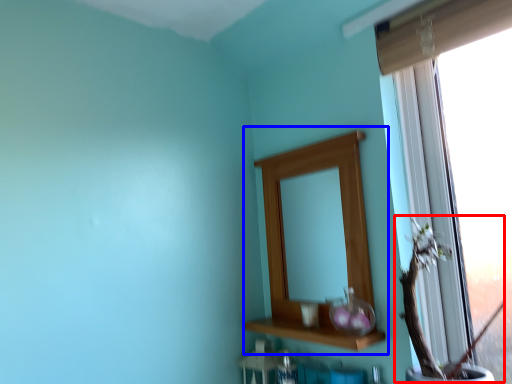
Question: Which point is further to the camera, floral arrangement (highlighted by a red box) or medicine cabinet (highlighted by a blue box)?

Choices:
 (A) floral arrangement
 (B) medicine cabinet

Answer: (B)